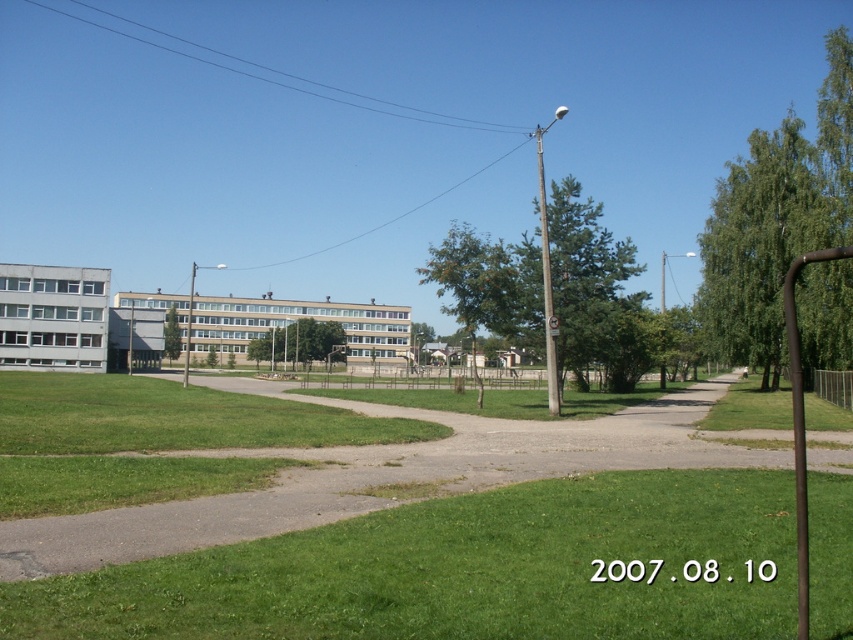
Question: Can you confirm if green grass at lower left is thinner than metallic pole at center?

Choices:
 (A) yes
 (B) no

Answer: (A)

Question: Which point is farther to the camera?

Choices:
 (A) metallic pole at center
 (B) green grass at lower left
 (C) gravel path at center

Answer: (A)

Question: Where is green grass at lower left located in relation to metallic pole at center in the image?

Choices:
 (A) right
 (B) left

Answer: (A)

Question: Which point is closer to the camera?

Choices:
 (A) (219, 268)
 (B) (538, 164)

Answer: (A)

Question: Which point is farther from the camera taking this photo?

Choices:
 (A) (514, 512)
 (B) (651, 444)

Answer: (B)

Question: Is green grass at lower left positioned before gravel path at center?

Choices:
 (A) no
 (B) yes

Answer: (B)